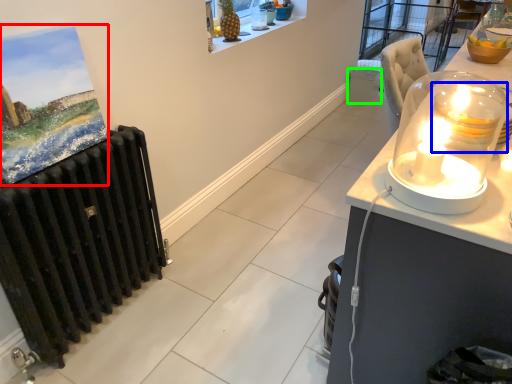
Question: Which object is the closest to the picture frame (highlighted by a red box)? Choose among these: candle holder (highlighted by a blue box) or trash bin/can (highlighted by a green box).

Choices:
 (A) candle holder
 (B) trash bin/can

Answer: (A)